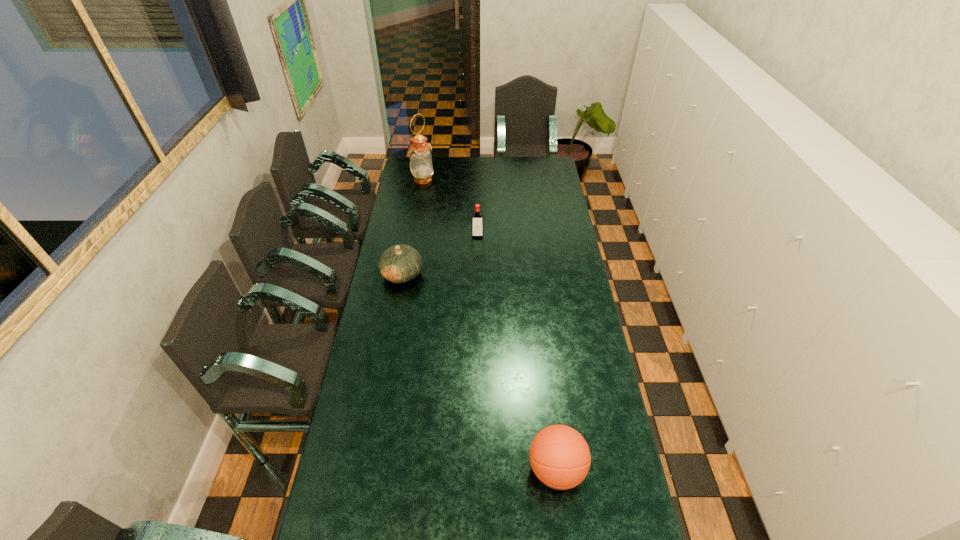
Locate an element on the screen. unoccupied area between the farthest object and the second farthest object is located at coordinates (450, 207).

Locate an element on the screen. Image resolution: width=960 pixels, height=540 pixels. free spot between the tallest object and the basketball is located at coordinates (490, 324).

Locate an element on the screen. free spot between the nearest object and the vodka is located at coordinates (516, 352).

The image size is (960, 540). In order to click on free point between the tallest object and the vodka in this screenshot , I will do `click(450, 207)`.

Locate an element on the screen. The width and height of the screenshot is (960, 540). empty location between the tallest object and the second object from right to left is located at coordinates (450, 207).

This screenshot has width=960, height=540. I want to click on free space between the gourd and the second object from right to left, so pyautogui.click(x=440, y=255).

Where is `empty space between the farthest object and the third farthest object`? The height and width of the screenshot is (540, 960). empty space between the farthest object and the third farthest object is located at coordinates (413, 227).

Locate an element on the screen. free space between the rightmost object and the tallest object is located at coordinates (490, 324).

Where is `empty space between the third nearest object and the oil lamp`? The image size is (960, 540). empty space between the third nearest object and the oil lamp is located at coordinates (450, 207).

The image size is (960, 540). In order to click on vacant area that lies between the second nearest object and the rightmost object in this screenshot , I will do (479, 372).